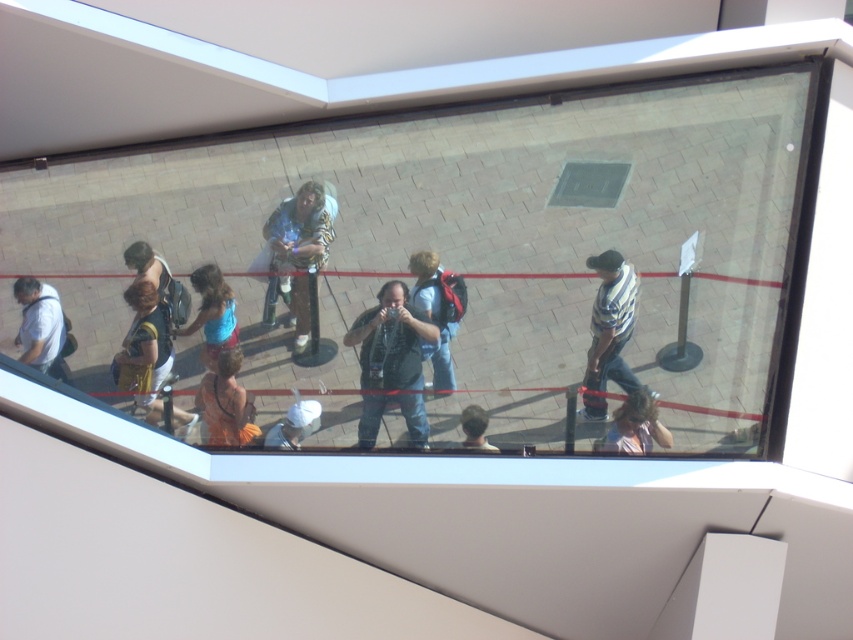
Is point (169, 332) positioned before point (178, 300)?

Yes, point (169, 332) is in front of point (178, 300).

Can you confirm if dark brown leather jacket at lower left is positioned below matte black backpack at lower left?

Indeed, dark brown leather jacket at lower left is positioned under matte black backpack at lower left.

Between point (171, 342) and point (135, 268), which one is positioned behind?

The point (135, 268) is more distant.

Locate an element on the screen. This screenshot has width=853, height=640. dark brown leather jacket at lower left is located at coordinates (144, 349).

Is striped fabric jacket at center thinner than matte black sunglasses at lower right?

Incorrect, striped fabric jacket at center's width is not less than matte black sunglasses at lower right's.

Who is more distant from viewer, (321,220) or (642,392)?

The point (321,220) is behind.

I want to click on striped fabric jacket at center, so click(300, 248).

Is striped shirt at right above light brown hair at center?

Indeed, striped shirt at right is positioned over light brown hair at center.

Can you confirm if striped shirt at right is thinner than light brown hair at center?

In fact, striped shirt at right might be wider than light brown hair at center.

Is point (619, 330) more distant than point (477, 428)?

That is True.

Locate an element on the screen. striped shirt at right is located at coordinates (611, 323).